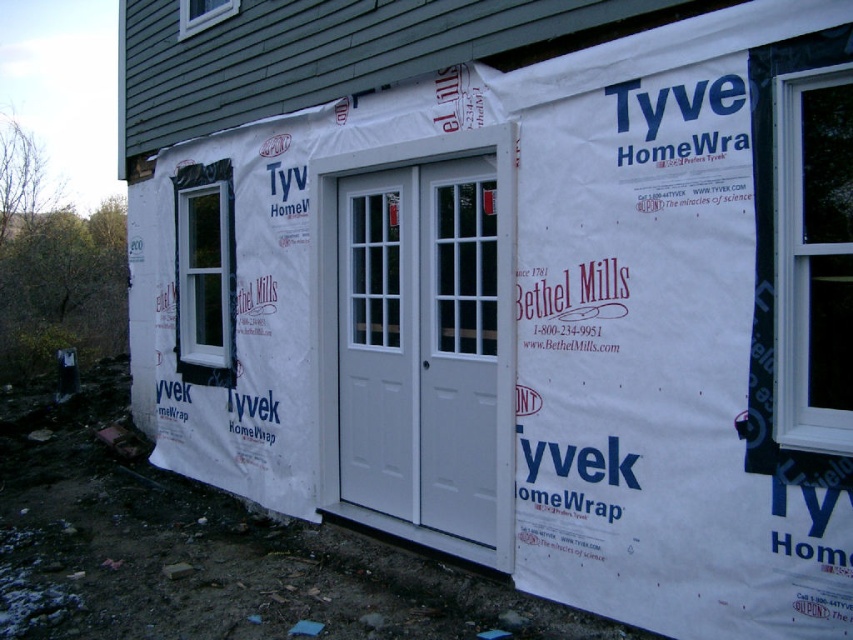
Consider the image. You are a contractor assessing the exterior of a house under construction. You notice the white painted wood screen door at center and the white plastic window at right. Which object is taller?

The white painted wood screen door at center is taller than the white plastic window at right.

You are a contractor assessing the exterior of a house under construction. You notice the white painted wood screen door at center and the white plastic window at right. Which object has a greater surface area?

The white painted wood screen door at center has a larger size compared to the white plastic window at right, so it has a greater surface area.

Consider the image. You are a construction worker standing at the point labeled point at (782, 253). You need to reach a tool placed exactly 3.32 meters away from your current position. Can you safely walk straight to the tool without stepping over any construction barriers?

Yes, since the tool is exactly 3.32 meters away from the point at (782, 253), which is the distance specified in the description, so walking straight should be possible without obstacles.